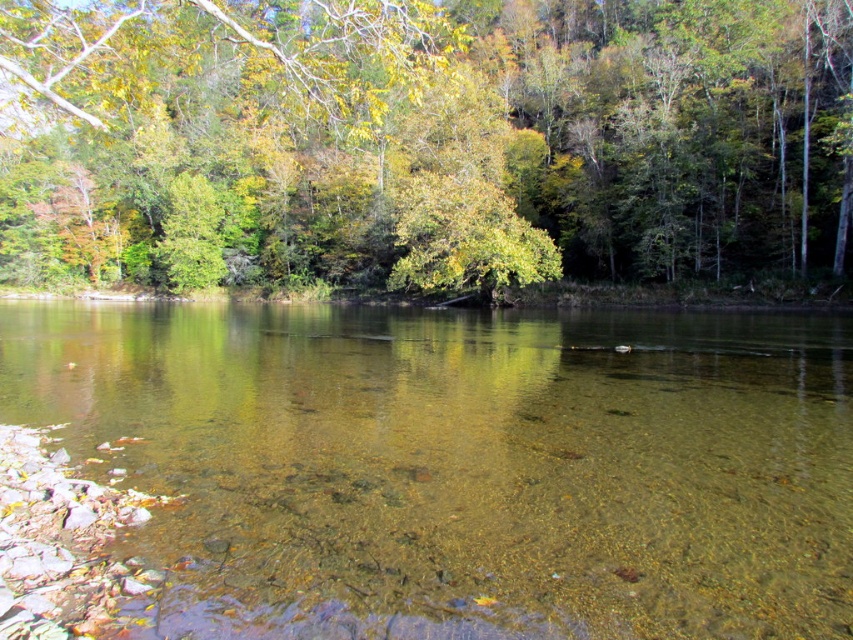
Which is behind, point (730, 483) or point (820, 20)?

The point (820, 20) is behind.

Who is shorter, clear glass water at center or green leafy tree at upper center?

With less height is clear glass water at center.

Find the location of a particular element. The width and height of the screenshot is (853, 640). clear glass water at center is located at coordinates (462, 465).